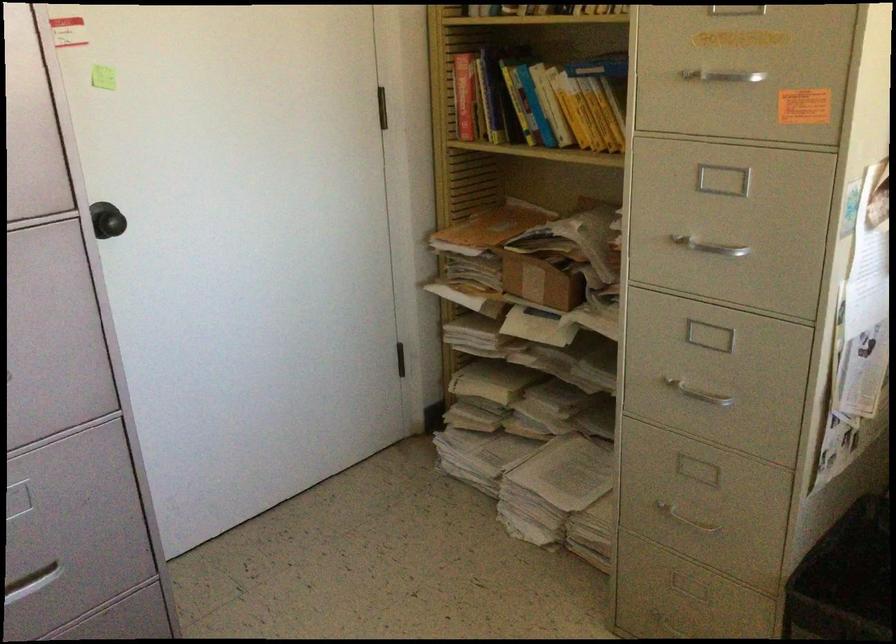
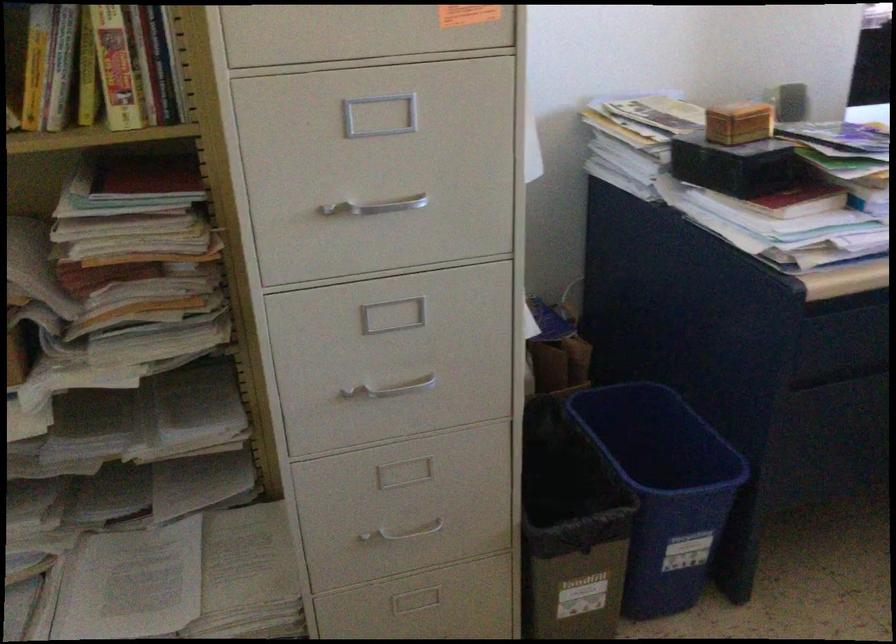
Question: The images are taken continuously from a first-person perspective. In which direction is your viewpoint rotating?

Choices:
 (A) Left
 (B) Right
 (C) Up
 (D) Down

Answer: (B)